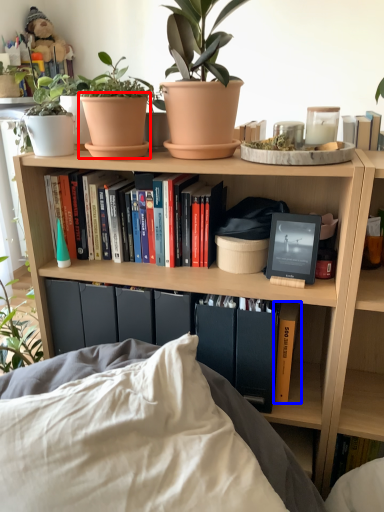
Question: Which of the following is the farthest to the observer, flowerpot (highlighted by a red box) or book (highlighted by a blue box)?

Choices:
 (A) flowerpot
 (B) book

Answer: (B)